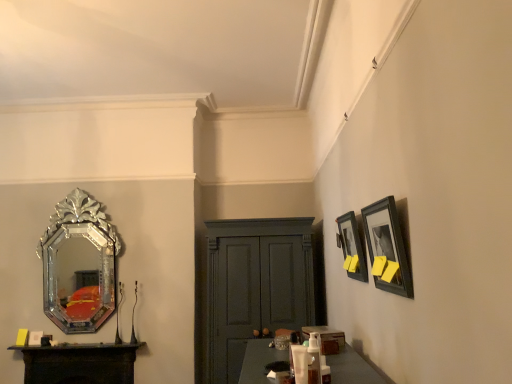
Identify the location of matte gray cabinet at center. (255, 286).

What do you see at coordinates (80, 363) in the screenshot? The width and height of the screenshot is (512, 384). I see `dark wood table at lower left` at bounding box center [80, 363].

Image resolution: width=512 pixels, height=384 pixels. Describe the element at coordinates (351, 247) in the screenshot. I see `matte black picture frame at upper right, marked as the first picture frame in a back-to-front arrangement` at that location.

In order to face silver/glass mirror at left, should I rotate leftwards or rightwards?

A 22.642 degree turn to the left will do.

Locate an element on the screen. The height and width of the screenshot is (384, 512). silver/glass mirror at left is located at coordinates (79, 264).

What is the approximate height of translucent plastic bottle at center, the first toiletry from the left?

translucent plastic bottle at center, the first toiletry from the left, is 6.59 inches tall.

What are the coordinates of `translucent plastic pump bottle at center, the first toiletry in the right-to-left sequence` in the screenshot? It's located at (313, 359).

You are a GUI agent. You are given a task and a screenshot of the screen. Output one action in this format:
    pyautogui.click(x=<x>, y=<y>)
    Task: Click on the black matte picture frame at upper right, the second picture frame from the back
    This screenshot has height=384, width=512.
    Given the screenshot: What is the action you would take?
    pyautogui.click(x=387, y=248)

Locate an element on the screen. The image size is (512, 384). matte gray cabinet at center is located at coordinates (255, 286).

From the image's perspective, is silver/glass mirror at left above or below black matte picture frame at upper right, arranged as the 1th picture frame when viewed from the front?

silver/glass mirror at left is below black matte picture frame at upper right, arranged as the 1th picture frame when viewed from the front.

Who is smaller, silver/glass mirror at left or black matte picture frame at upper right, arranged as the 1th picture frame when viewed from the front?

Smaller between the two is black matte picture frame at upper right, arranged as the 1th picture frame when viewed from the front.

Considering the points (47, 290) and (406, 281), which point is in front, point (47, 290) or point (406, 281)?

The point (406, 281) is closer.

Is silver/glass mirror at left spatially inside black matte picture frame at upper right, arranged as the 1th picture frame when viewed from the front, or outside of it?

silver/glass mirror at left is not inside black matte picture frame at upper right, arranged as the 1th picture frame when viewed from the front, it's outside.

Which object is further away from the camera taking this photo, dark wood table at lower left or translucent plastic bottle at center, the second toiletry when ordered from front to back?

dark wood table at lower left is behind.

Is dark wood table at lower left turned away from translucent plastic bottle at center, which is counted as the 1th toiletry, starting from the back?

dark wood table at lower left does not have its back to translucent plastic bottle at center, which is counted as the 1th toiletry, starting from the back.

From a real-world perspective, does dark wood table at lower left stand above translucent plastic bottle at center, the second toiletry when ordered from front to back?

No, from a real-world perspective, dark wood table at lower left is not over translucent plastic bottle at center, the second toiletry when ordered from front to back

Between point (116, 350) and point (291, 334), which one is positioned in front?

The point (291, 334) is in front.

From the image's perspective, which object appears higher, translucent plastic pump bottle at center, placed as the second toiletry when sorted from left to right, or matte black picture frame at upper right, marked as the first picture frame in a back-to-front arrangement?

matte black picture frame at upper right, marked as the first picture frame in a back-to-front arrangement.

Consider the image. Considering the relative sizes of translucent plastic pump bottle at center, the 2th toiletry positioned from the back, and matte black picture frame at upper right, marked as the first picture frame in a back-to-front arrangement, in the image provided, is translucent plastic pump bottle at center, the 2th toiletry positioned from the back, thinner than matte black picture frame at upper right, marked as the first picture frame in a back-to-front arrangement,?

Correct, the width of translucent plastic pump bottle at center, the 2th toiletry positioned from the back, is less than that of matte black picture frame at upper right, marked as the first picture frame in a back-to-front arrangement.

Looking at this image, how many degrees apart are the facing directions of translucent plastic pump bottle at center, acting as the 1th toiletry starting from the front, and matte black picture frame at upper right, marked as the first picture frame in a back-to-front arrangement?

They differ by 1.13 degrees in their facing directions.

Is translucent plastic pump bottle at center, placed as the second toiletry when sorted from left to right, touching matte black picture frame at upper right, the second picture frame viewed from the front?

No.

Which is farther from the camera, (234, 231) or (312, 340)?

Positioned behind is point (234, 231).

Does matte gray cabinet at center come in front of translucent plastic pump bottle at center, placed as the second toiletry when sorted from left to right?

No, it is not.

From a real-world perspective, which object stands above the other?

In real-world perspective, translucent plastic pump bottle at center, placed as the second toiletry when sorted from left to right, is above.

This screenshot has width=512, height=384. I want to click on toiletry that is the 2nd one when counting leftward from the black matte picture frame at upper right, arranged as the 1th picture frame when viewed from the front, so click(x=291, y=350).

From the picture: Is black matte picture frame at upper right, the second picture frame from the back, touching translucent plastic bottle at center, which is counted as the 1th toiletry, starting from the back?

There is a gap between black matte picture frame at upper right, the second picture frame from the back, and translucent plastic bottle at center, which is counted as the 1th toiletry, starting from the back.

Considering the sizes of black matte picture frame at upper right, arranged as the 1th picture frame when viewed from the front, and translucent plastic bottle at center, the second toiletry when ordered from front to back, in the image, is black matte picture frame at upper right, arranged as the 1th picture frame when viewed from the front, bigger or smaller than translucent plastic bottle at center, the second toiletry when ordered from front to back,?

Considering their sizes, black matte picture frame at upper right, arranged as the 1th picture frame when viewed from the front, takes up more space than translucent plastic bottle at center, the second toiletry when ordered from front to back.

From the image's perspective, is black matte picture frame at upper right, the second picture frame from the back, above or below translucent plastic bottle at center, the second toiletry when ordered from front to back?

Clearly, from the image's perspective, black matte picture frame at upper right, the second picture frame from the back, is above translucent plastic bottle at center, the second toiletry when ordered from front to back.

Is point (395, 261) behind point (315, 363)?

Yes, point (395, 261) is behind point (315, 363).

From a real-world perspective, count 1st toiletrys downward from the black matte picture frame at upper right, the second picture frame from the back, and point to it. Please provide its 2D coordinates.

[(313, 359)]

Based on the photo, from the image's perspective, does black matte picture frame at upper right, the second picture frame from the back, appear higher than translucent plastic pump bottle at center, placed as the second toiletry when sorted from left to right?

Yes, from the image's perspective, black matte picture frame at upper right, the second picture frame from the back, is over translucent plastic pump bottle at center, placed as the second toiletry when sorted from left to right.

Is matte gray cabinet at center shorter than black matte picture frame at upper right, arranged as the 1th picture frame when viewed from the front?

In fact, matte gray cabinet at center may be taller than black matte picture frame at upper right, arranged as the 1th picture frame when viewed from the front.

Considering the relative positions of matte gray cabinet at center and black matte picture frame at upper right, arranged as the 1th picture frame when viewed from the front, in the image provided, is matte gray cabinet at center to the right of black matte picture frame at upper right, arranged as the 1th picture frame when viewed from the front, from the viewer's perspective?

No, matte gray cabinet at center is not to the right of black matte picture frame at upper right, arranged as the 1th picture frame when viewed from the front.

From a real-world perspective, relative to black matte picture frame at upper right, the second picture frame from the back, is matte gray cabinet at center vertically above or below?

In terms of real-world spatial position, matte gray cabinet at center is below black matte picture frame at upper right, the second picture frame from the back.

Considering the sizes of matte gray cabinet at center and black matte picture frame at upper right, arranged as the 1th picture frame when viewed from the front, in the image, is matte gray cabinet at center wider or thinner than black matte picture frame at upper right, arranged as the 1th picture frame when viewed from the front,?

In the image, matte gray cabinet at center appears to be wider than black matte picture frame at upper right, arranged as the 1th picture frame when viewed from the front.

The height and width of the screenshot is (384, 512). In order to click on mirror located below the black matte picture frame at upper right, the second picture frame from the back (from the image's perspective) in this screenshot , I will do `click(79, 264)`.

From the dark wood table at lower left, count 1st toiletry to the right and point to it. Please provide its 2D coordinates.

[(291, 350)]

Estimate the real-world distances between objects in this image. Which object is further from dark wood table at lower left, silver/glass mirror at left or black matte picture frame at upper right, arranged as the 1th picture frame when viewed from the front?

black matte picture frame at upper right, arranged as the 1th picture frame when viewed from the front, is further to dark wood table at lower left.

Which object lies further to the anchor point matte gray cabinet at center, dark wood table at lower left or silver/glass mirror at left?

silver/glass mirror at left lies further to matte gray cabinet at center than the other object.

Estimate the real-world distances between objects in this image. Which object is further from translucent plastic bottle at center, the first toiletry from the left, dark wood table at lower left or matte gray cabinet at center?

The object further to translucent plastic bottle at center, the first toiletry from the left, is dark wood table at lower left.

When comparing their distances from silver/glass mirror at left, does translucent plastic bottle at center, the second toiletry when ordered from front to back, or matte gray cabinet at center seem further?

translucent plastic bottle at center, the second toiletry when ordered from front to back, is further to silver/glass mirror at left.

From the picture: Considering their positions, is black matte picture frame at upper right, arranged as the 1th picture frame when viewed from the front, positioned further to dark wood table at lower left than translucent plastic bottle at center, the second toiletry positioned from the right?

Among the two, black matte picture frame at upper right, arranged as the 1th picture frame when viewed from the front, is located further to dark wood table at lower left.

Which object lies further to the anchor point dark wood table at lower left, translucent plastic bottle at center, the second toiletry when ordered from front to back, or translucent plastic pump bottle at center, acting as the 1th toiletry starting from the front?

translucent plastic pump bottle at center, acting as the 1th toiletry starting from the front, is positioned further to the anchor dark wood table at lower left.

Estimate the real-world distances between objects in this image. Which object is further from translucent plastic bottle at center, the second toiletry positioned from the right, dark wood table at lower left or black matte picture frame at upper right, arranged as the 1th picture frame when viewed from the front?

dark wood table at lower left is positioned further to the anchor translucent plastic bottle at center, the second toiletry positioned from the right.

Considering their positions, is black matte picture frame at upper right, arranged as the 1th picture frame when viewed from the front, positioned closer to dark wood table at lower left than matte black picture frame at upper right, the second picture frame viewed from the front?

matte black picture frame at upper right, the second picture frame viewed from the front, lies closer to dark wood table at lower left than the other object.

The image size is (512, 384). I want to click on picture frame between translucent plastic bottle at center, the first toiletry from the left, and matte gray cabinet at center from front to back, so click(x=351, y=247).

The width and height of the screenshot is (512, 384). In order to click on cabinetry between translucent plastic bottle at center, which is counted as the 1th toiletry, starting from the back, and dark wood table at lower left from front to back in this screenshot , I will do `click(255, 286)`.

This screenshot has height=384, width=512. I want to click on picture frame between silver/glass mirror at left and matte black picture frame at upper right, the second picture frame viewed from the front, so click(x=387, y=248).

Find the location of a particular element. toiletry between translucent plastic pump bottle at center, the 2th toiletry positioned from the back, and matte black picture frame at upper right, marked as the first picture frame in a back-to-front arrangement, in the front-back direction is located at coordinates (291, 350).